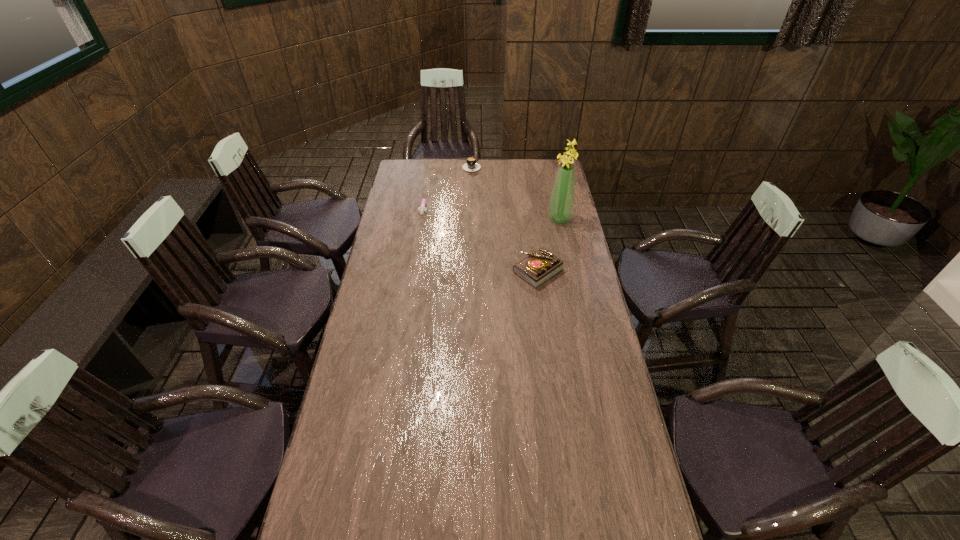
What are the coordinates of `vacant region at the left edge of the desktop` in the screenshot? It's located at (349, 366).

At what (x,y) coordinates should I click in order to perform the action: click on blank space at the right edge of the desktop. Please return your answer as a coordinate pair (x, y). This screenshot has width=960, height=540. Looking at the image, I should click on (587, 388).

Where is `vacant region at the far right corner of the desktop`? The width and height of the screenshot is (960, 540). vacant region at the far right corner of the desktop is located at coordinates (537, 171).

The height and width of the screenshot is (540, 960). In order to click on vacant area between the tallest object and the leftmost object in this screenshot , I will do `click(492, 212)`.

Where is `free point between the farthest object and the tallest object`? The height and width of the screenshot is (540, 960). free point between the farthest object and the tallest object is located at coordinates (516, 192).

Find the location of a particular element. This screenshot has width=960, height=540. vacant region between the diary and the shortest object is located at coordinates (481, 238).

You are a GUI agent. You are given a task and a screenshot of the screen. Output one action in this format:
    pyautogui.click(x=<x>, y=<y>)
    Task: Click on the vacant area between the syringe and the diary
    This screenshot has width=960, height=540.
    Given the screenshot: What is the action you would take?
    pyautogui.click(x=481, y=238)

Image resolution: width=960 pixels, height=540 pixels. I want to click on vacant region between the farthest object and the syringe, so click(x=447, y=185).

You are a GUI agent. You are given a task and a screenshot of the screen. Output one action in this format:
    pyautogui.click(x=<x>, y=<y>)
    Task: Click on the unoccupied position between the diary and the farthest object
    
    Given the screenshot: What is the action you would take?
    pyautogui.click(x=505, y=218)

You are a GUI agent. You are given a task and a screenshot of the screen. Output one action in this format:
    pyautogui.click(x=<x>, y=<y>)
    Task: Click on the empty location between the diary and the bouquet
    
    Given the screenshot: What is the action you would take?
    pyautogui.click(x=548, y=245)